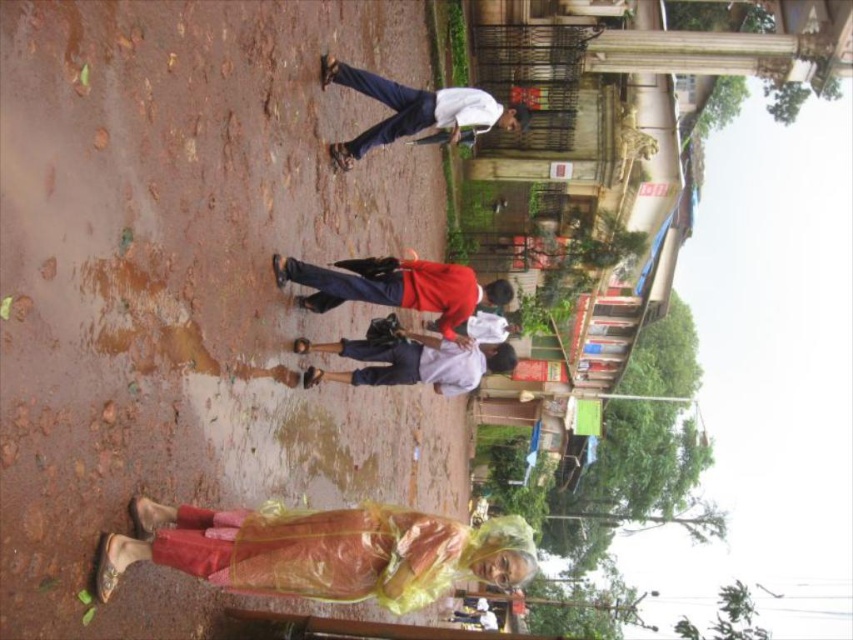
You are a photographer trying to capture a photo of the two children in the scene. The children are wearing a red fabric shirt at center and a white cotton shirt at center. Which child should you focus on first if you want to photograph the one closer to the left side?

The white cotton shirt at center is closer to the left side, so you should focus on the child wearing the white cotton shirt at center first.

You are a photographer trying to capture the translucent yellow raincoat at lower center and the red fabric shirt at center in the same frame. Since the raincoat is larger, which object will appear bigger in your photo?

The translucent yellow raincoat at lower center will appear bigger in the photo because it is larger in size than the red fabric shirt at center.